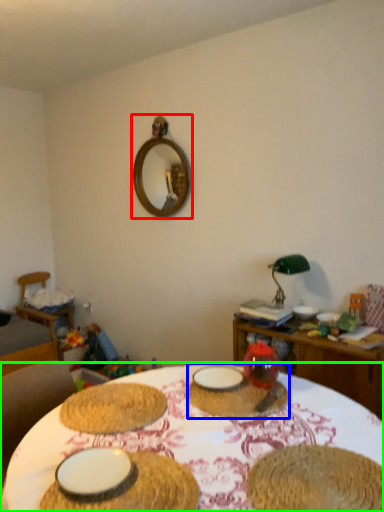
Question: Estimate the real-world distances between objects in this image. Which object is closer to mirror (highlighted by a red box), tableware (highlighted by a blue box) or table (highlighted by a green box)?

Choices:
 (A) tableware
 (B) table

Answer: (A)